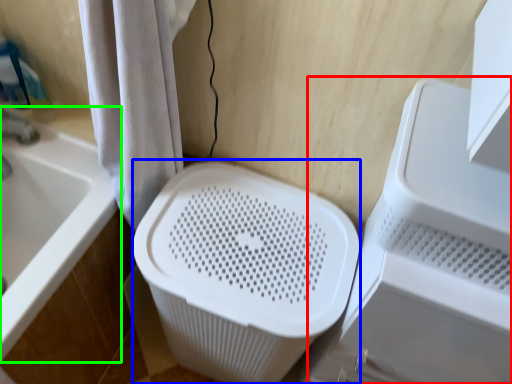
Question: Based on their relative distances, which object is nearer to appliance (highlighted by a red box)? Choose from laundry basket (highlighted by a blue box) and bathtub (highlighted by a green box).

Choices:
 (A) laundry basket
 (B) bathtub

Answer: (A)